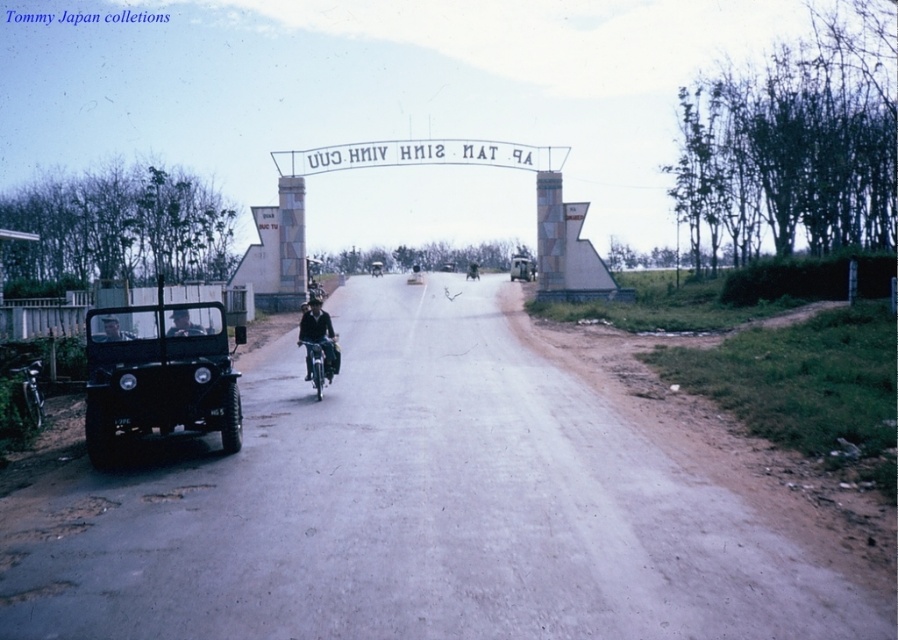
Question: Which point appears farthest from the camera in this image?

Choices:
 (A) (115, 324)
 (B) (505, 152)

Answer: (B)

Question: Which of the following is the closest to the observer?

Choices:
 (A) (112, 326)
 (B) (320, 321)

Answer: (A)

Question: Does matte black jeep at left appear on the right side of dark blue leather jacket at center?

Choices:
 (A) no
 (B) yes

Answer: (B)

Question: Is brown dirt track at center bigger than matte black jeep at center?

Choices:
 (A) no
 (B) yes

Answer: (A)

Question: Can you confirm if matte black jeep at left is bigger than white fabric banner at center?

Choices:
 (A) yes
 (B) no

Answer: (B)

Question: Which object is closer to the camera taking this photo?

Choices:
 (A) dark blue leather jacket at center
 (B) dark blue uniform at left
 (C) matte black jeep at left

Answer: (C)